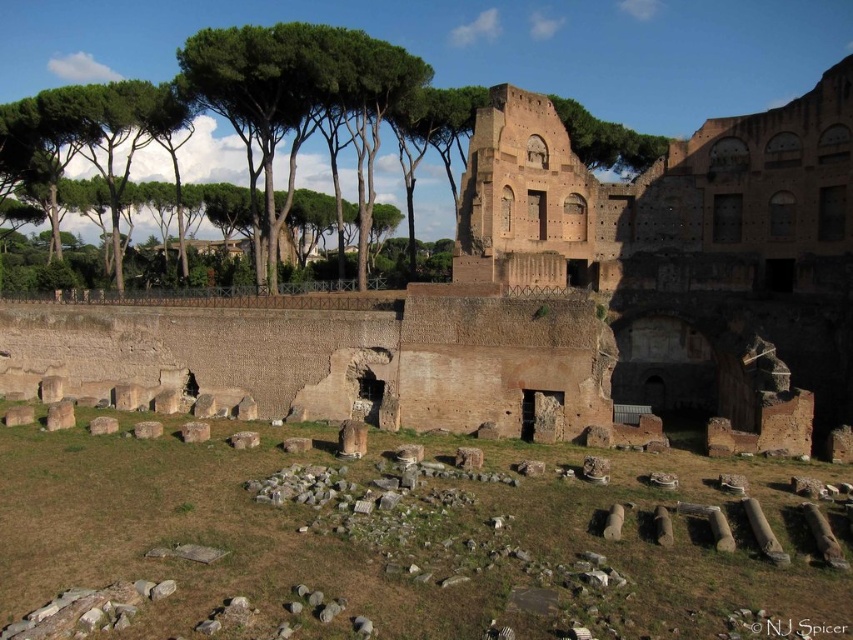
Question: Is brown brick amphitheater at center in front of transparent watermark at upper center?

Choices:
 (A) no
 (B) yes

Answer: (A)

Question: Among these points, which one is farthest from the camera?

Choices:
 (A) (793, 628)
 (B) (815, 339)

Answer: (B)

Question: Which object is closer to the camera taking this photo?

Choices:
 (A) transparent watermark at upper center
 (B) brown brick amphitheater at center

Answer: (A)

Question: Is brown brick amphitheater at center wider than transparent watermark at upper center?

Choices:
 (A) yes
 (B) no

Answer: (A)

Question: Can you confirm if brown brick amphitheater at center is positioned above transparent watermark at upper center?

Choices:
 (A) no
 (B) yes

Answer: (B)

Question: Which object appears farthest from the camera in this image?

Choices:
 (A) transparent watermark at upper center
 (B) brown brick amphitheater at center

Answer: (B)